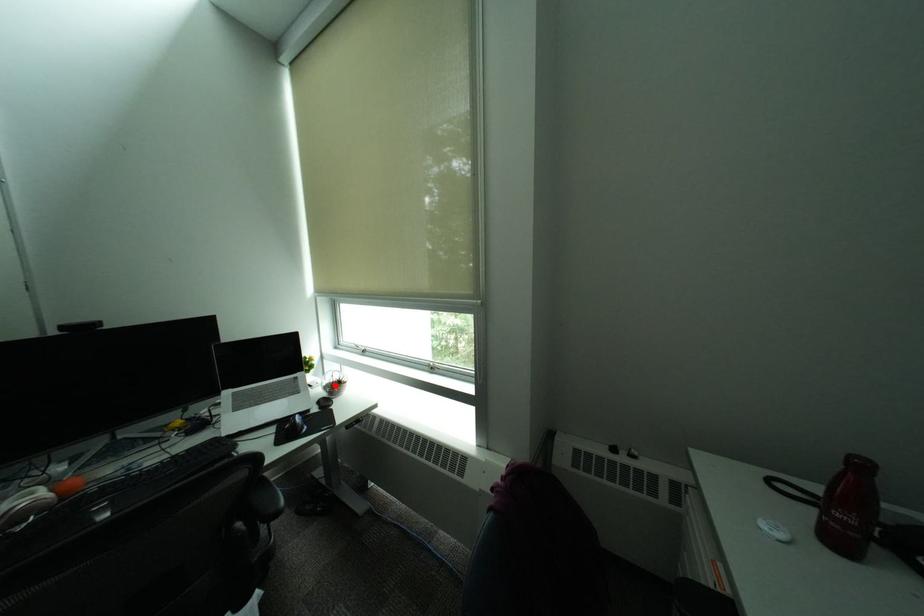
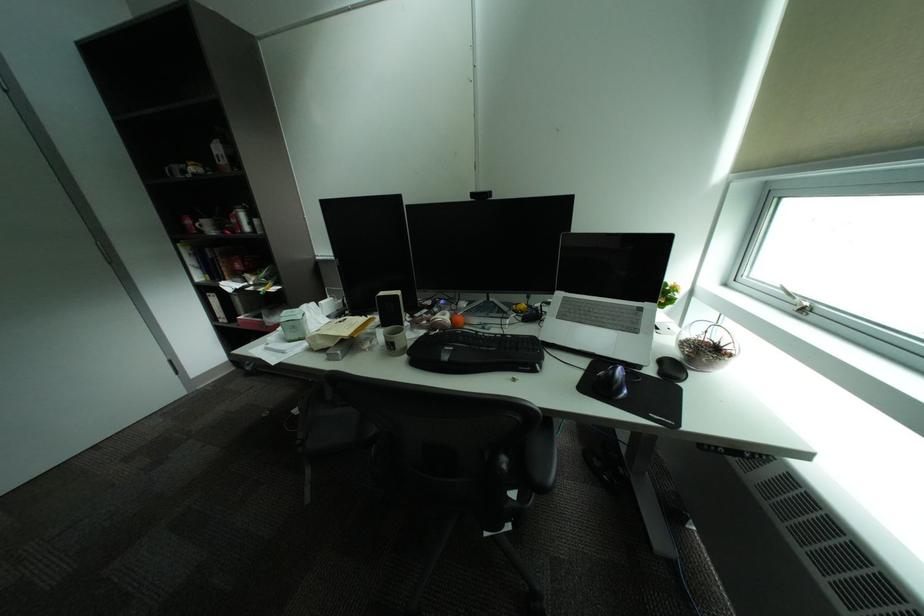
In the second image, find the point that corresponds to the highlighted location in the first image.

(694, 339)